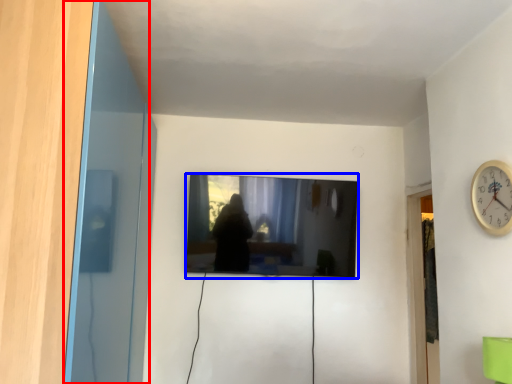
Question: Among these objects, which one is farthest to the camera, glass door (highlighted by a red box) or television (highlighted by a blue box)?

Choices:
 (A) glass door
 (B) television

Answer: (B)